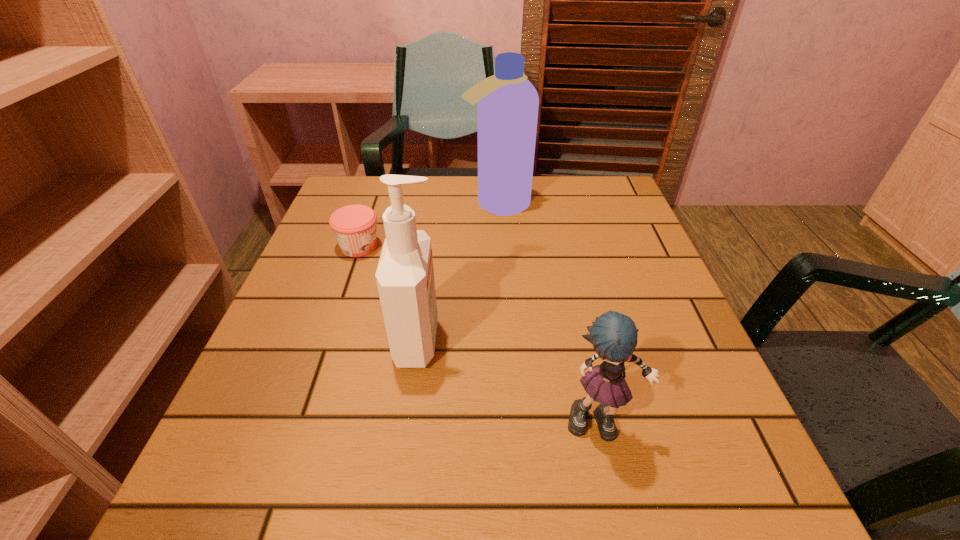
At what (x,y) coordinates should I click in order to perform the action: click on free space located on the front label of the third nearest object. Please return your answer as a coordinate pair (x, y). Looking at the image, I should click on (457, 246).

Find the location of `object that is at the far edge`. object that is at the far edge is located at coordinates (507, 103).

This screenshot has width=960, height=540. Find the location of `object located at the left edge`. object located at the left edge is located at coordinates (x=354, y=226).

I want to click on object positioned at the right edge, so click(613, 335).

You are a GUI agent. You are given a task and a screenshot of the screen. Output one action in this format:
    pyautogui.click(x=<x>, y=<y>)
    Task: Click on the vacant space at the far edge of the desktop
    This screenshot has width=960, height=540.
    Given the screenshot: What is the action you would take?
    pyautogui.click(x=538, y=188)

The width and height of the screenshot is (960, 540). In the image, there is a desktop. Find the location of `vacant space at the near edge`. vacant space at the near edge is located at coordinates (487, 512).

Locate an element on the screen. The width and height of the screenshot is (960, 540). vacant space at the left edge is located at coordinates (345, 260).

Identify the location of vacant space at the right edge of the desktop. point(679,384).

Find the location of `free space at the far left corner of the desktop`. free space at the far left corner of the desktop is located at coordinates (363, 184).

At what (x,y) coordinates should I click in order to perform the action: click on free region at the far right corner. Please return your answer as a coordinate pair (x, y). This screenshot has width=960, height=540. Looking at the image, I should click on (586, 188).